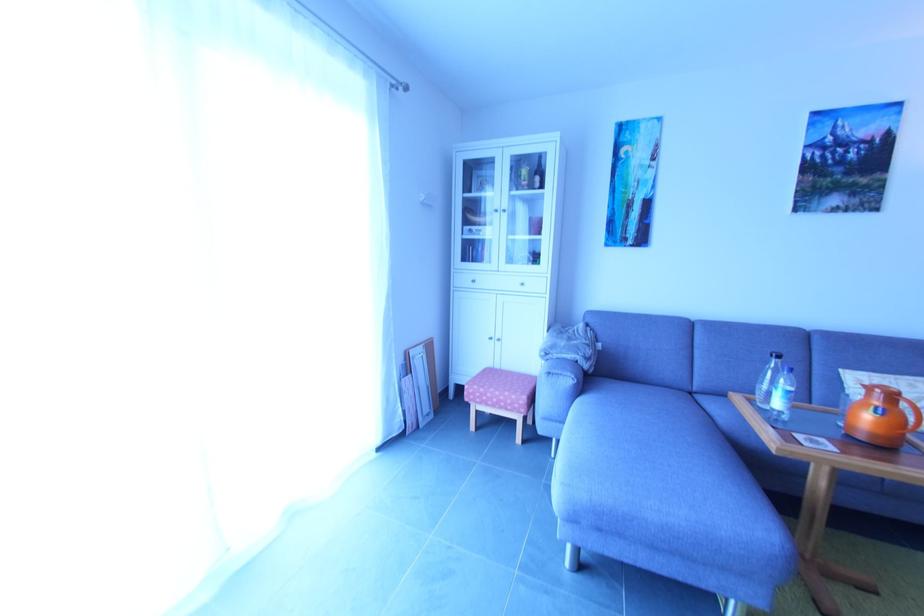
At what (x,y) coordinates should I click in order to perform the action: click on orange pitcher handle. Please return your answer as a coordinate pair (x, y). The image size is (924, 616). Looking at the image, I should click on (881, 416).